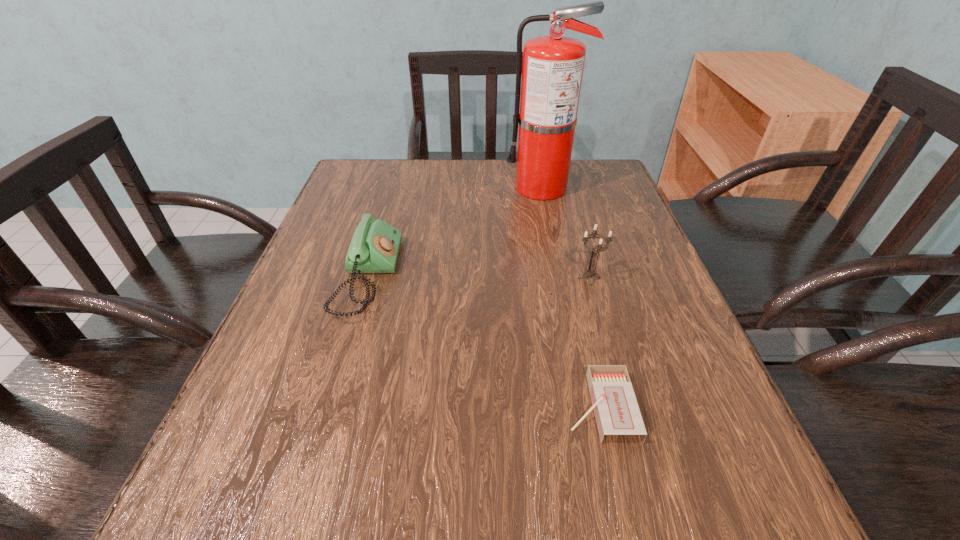
This screenshot has height=540, width=960. Identify the location of object at the far right corner. (552, 69).

Find the location of a particular element. free space at the far edge is located at coordinates pyautogui.click(x=428, y=166).

The width and height of the screenshot is (960, 540). In the image, there is a desktop. Identify the location of vacant space at the near edge. (423, 523).

The height and width of the screenshot is (540, 960). Find the location of `vacant space at the left edge of the desktop`. vacant space at the left edge of the desktop is located at coordinates (324, 245).

The width and height of the screenshot is (960, 540). What are the coordinates of `vacant space at the right edge` in the screenshot? It's located at (633, 222).

Identify the location of free region at the far right corner of the desktop. (618, 183).

Where is `free space between the leftmost object and the second tallest object`? free space between the leftmost object and the second tallest object is located at coordinates (x=479, y=278).

Locate an element on the screen. empty space between the leftmost object and the third shortest object is located at coordinates pyautogui.click(x=479, y=278).

Image resolution: width=960 pixels, height=540 pixels. Identify the location of vacant space in between the leftmost object and the shortest object. (484, 342).

I want to click on free point between the tallest object and the candle holder, so (565, 233).